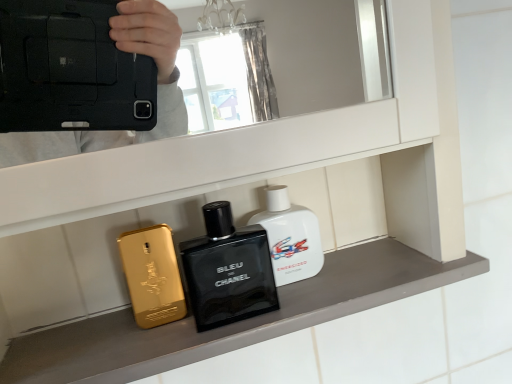
Identify the location of blank area to the left of black glass perfume at center. (109, 344).